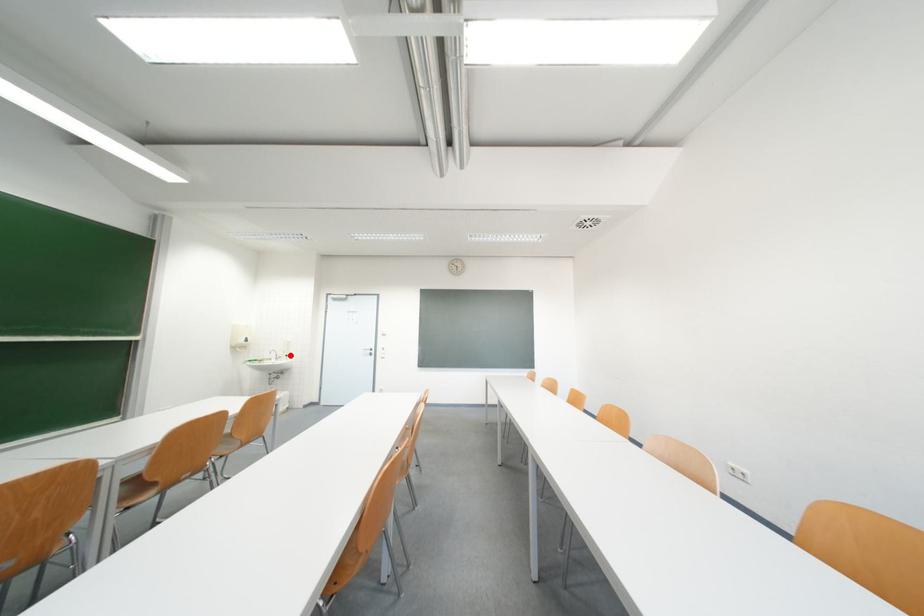
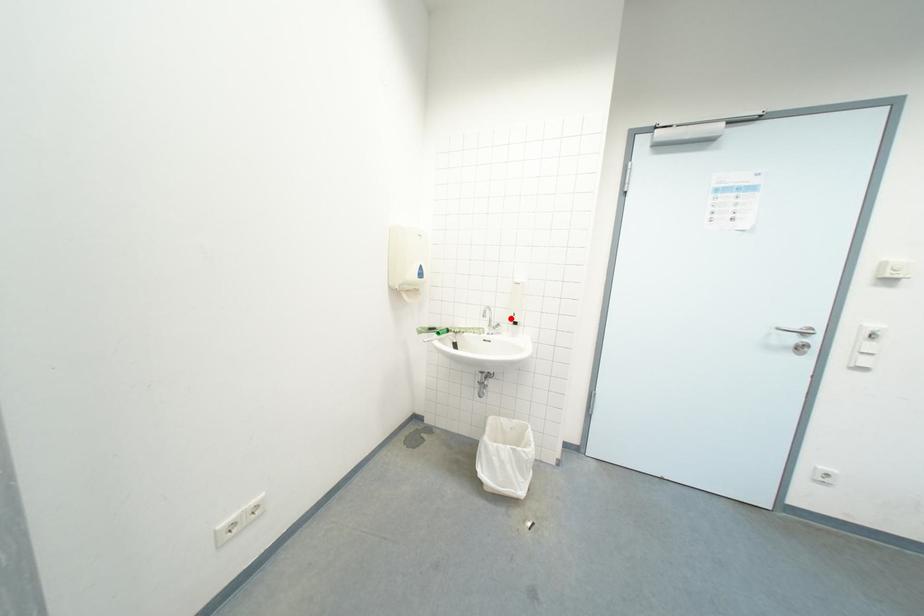
I am providing you with two images of the same scene from different viewpoints. A red point is marked on the first image and another point is marked on the second image. Is the marked point in image1 the same physical position as the marked point in image2?

Yes